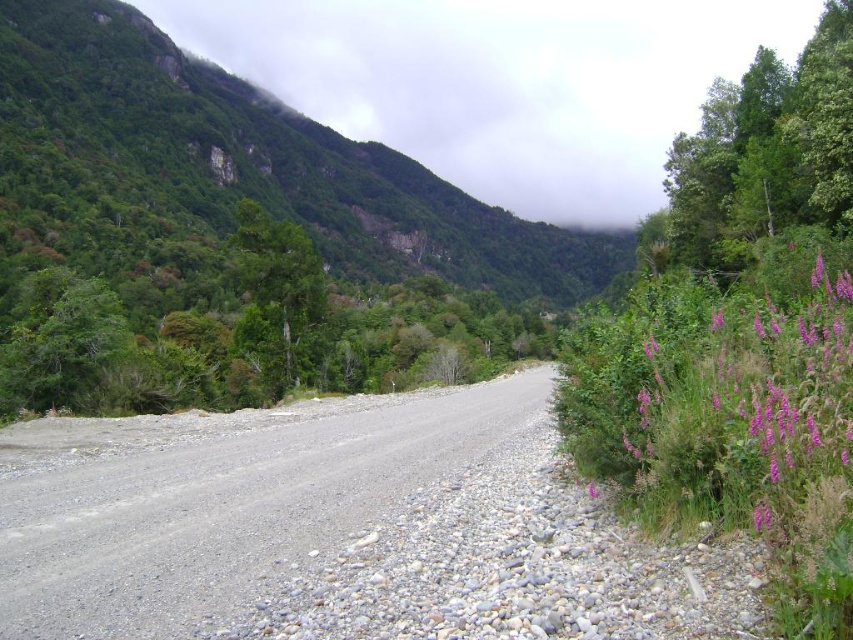
You are a botanist examining the purple fuzzy flowers at right and the purple matte flower at right along a gravel road in a valley. Which of these two flowers is taller?

The purple fuzzy flowers at right are much taller than the purple matte flower at right.

You are a hiker planning to take a photo of the green textured rock at upper center while standing on the gravel road. Based on the scene description, where should you position yourself relative to the gravel road and the purple flowers to capture the rock in your shot?

The green textured rock at upper center is located at point (252,160), so you should position yourself on the gravel road towards the upper center area, ensuring the purple flowers on the right side of the road are in your frame to capture the rock in your photo.

You are a hiker planning to walk along the gravel road in the valley. You notice the green textured rock at upper center and the purple fuzzy flowers at right. Which object is higher up in the landscape?

The green textured rock at upper center is positioned over the purple fuzzy flowers at right, so it is higher up in the landscape.